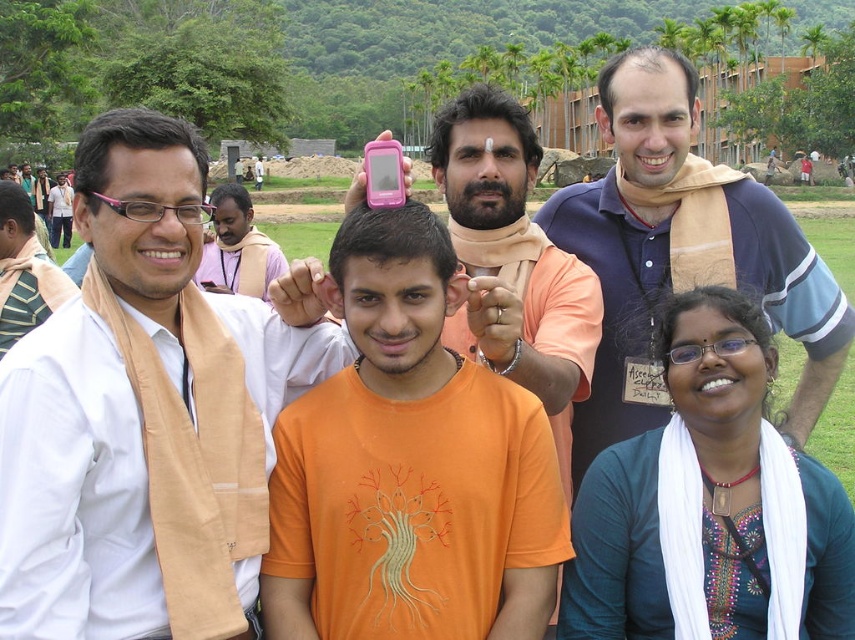
Between white cotton shirt at left and white fabric scarf at lower right, which one appears on the right side from the viewer's perspective?

white fabric scarf at lower right

How far apart are white cotton shirt at left and white fabric scarf at lower right?

white cotton shirt at left is 36.10 feet away from white fabric scarf at lower right.

Locate an element on the screen. The height and width of the screenshot is (640, 855). white cotton shirt at left is located at coordinates (133, 396).

You are a GUI agent. You are given a task and a screenshot of the screen. Output one action in this format:
    pyautogui.click(x=<x>, y=<y>)
    Task: Click on the white cotton shirt at left
    This screenshot has width=855, height=640.
    Given the screenshot: What is the action you would take?
    pyautogui.click(x=133, y=396)

Can you confirm if white cotton shirt at left is wider than orange cotton t-shirt at center?

No, white cotton shirt at left is not wider than orange cotton t-shirt at center.

Is white cotton shirt at left further to the viewer compared to orange cotton t-shirt at center?

No, white cotton shirt at left is closer to the viewer.

What do you see at coordinates (133, 396) in the screenshot?
I see `white cotton shirt at left` at bounding box center [133, 396].

Identify the location of white cotton shirt at left. (133, 396).

Is point (582, 513) positioned behind point (687, 65)?

No.

From the picture: Does white fabric scarf at lower right lie in front of blue cotton shirt at upper right?

Yes, white fabric scarf at lower right is closer to the viewer.

Is point (851, 538) in front of point (623, 401)?

That is True.

The height and width of the screenshot is (640, 855). Identify the location of white fabric scarf at lower right. (711, 502).